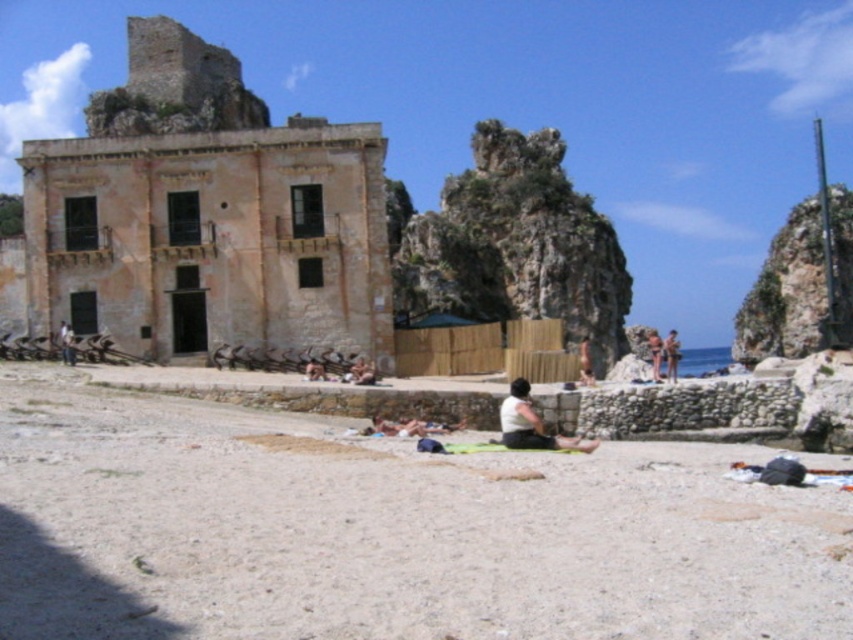
Which of these two, tan skin person at center or smooth skin person at center, stands shorter?

smooth skin person at center

Does tan skin person at center have a greater height compared to smooth skin person at center?

Yes, tan skin person at center is taller than smooth skin person at center.

Is point (669, 344) positioned in front of point (592, 380)?

No, it is not.

At what (x,y) coordinates should I click in order to perform the action: click on tan skin person at center. Please return your answer as a coordinate pair (x, y). This screenshot has width=853, height=640. Looking at the image, I should click on (671, 355).

Who is shorter, beige fabric towel at lower center or smooth skin person at center?

beige fabric towel at lower center

Which is more to the right, beige fabric towel at lower center or smooth skin person at center?

Result: From the viewer's perspective, smooth skin person at center appears more on the right side.

Who is more forward, (372, 428) or (582, 381)?

Positioned in front is point (372, 428).

Locate an element on the screen. This screenshot has height=640, width=853. beige fabric towel at lower center is located at coordinates (410, 428).

Measure the distance between tan skin person at center and dark skin textured person at center.

A distance of 96.80 feet exists between tan skin person at center and dark skin textured person at center.

Is point (672, 364) positioned behind point (648, 332)?

No, it is not.

The width and height of the screenshot is (853, 640). Identify the location of tan skin person at center. (671, 355).